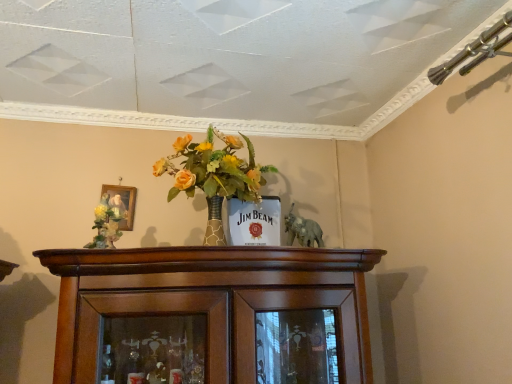
Question: Should I look upward or downward to see gold-framed painting at upper left?

Choices:
 (A) down
 (B) up

Answer: (A)

Question: Can you confirm if matte floral arrangement at left is taller than gold-framed painting at upper left?

Choices:
 (A) yes
 (B) no

Answer: (A)

Question: Considering the relative positions of matte floral arrangement at left and gold-framed painting at upper left in the image provided, is matte floral arrangement at left to the right of gold-framed painting at upper left from the viewer's perspective?

Choices:
 (A) no
 (B) yes

Answer: (B)

Question: Is matte floral arrangement at left not within gold-framed painting at upper left?

Choices:
 (A) yes
 (B) no

Answer: (A)

Question: From the image's perspective, would you say matte floral arrangement at left is positioned over gold-framed painting at upper left?

Choices:
 (A) no
 (B) yes

Answer: (A)

Question: Is gold-framed painting at upper left located within matte floral arrangement at left?

Choices:
 (A) yes
 (B) no

Answer: (B)

Question: Does matte floral arrangement at left touch gold-framed painting at upper left?

Choices:
 (A) yes
 (B) no

Answer: (B)

Question: Considering the relative sizes of gray matte elephant at center and matte floral arrangement at left in the image provided, is gray matte elephant at center bigger than matte floral arrangement at left?

Choices:
 (A) no
 (B) yes

Answer: (B)

Question: Could you tell me if gray matte elephant at center is turned towards matte floral arrangement at left?

Choices:
 (A) yes
 (B) no

Answer: (B)

Question: From a real-world perspective, is gray matte elephant at center over matte floral arrangement at left?

Choices:
 (A) no
 (B) yes

Answer: (A)

Question: Is matte floral arrangement at left at the back of gray matte elephant at center?

Choices:
 (A) no
 (B) yes

Answer: (A)

Question: Is gray matte elephant at center closer to camera compared to matte floral arrangement at left?

Choices:
 (A) no
 (B) yes

Answer: (A)

Question: Does gray matte elephant at center have a smaller size compared to matte floral arrangement at left?

Choices:
 (A) no
 (B) yes

Answer: (A)

Question: Does matte floral arrangement at left appear on the right side of gray matte elephant at center?

Choices:
 (A) no
 (B) yes

Answer: (A)